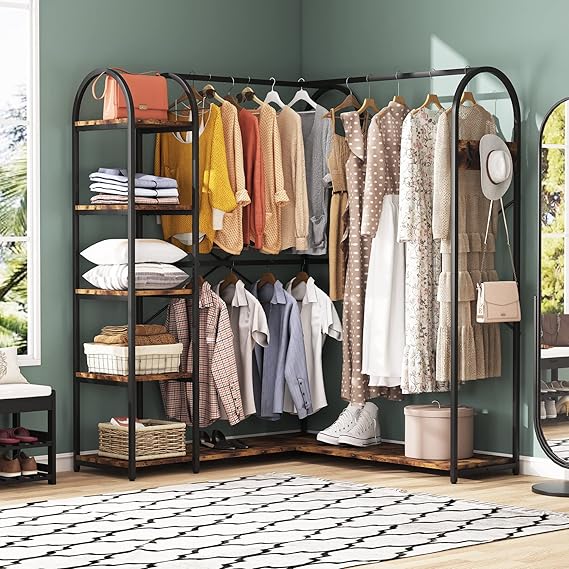
Find the location of a particular element. The image size is (569, 569). clothes rack frame is located at coordinates (380, 76), (258, 82), (340, 88), (517, 111), (456, 148), (131, 146), (72, 171), (195, 197), (138, 226).